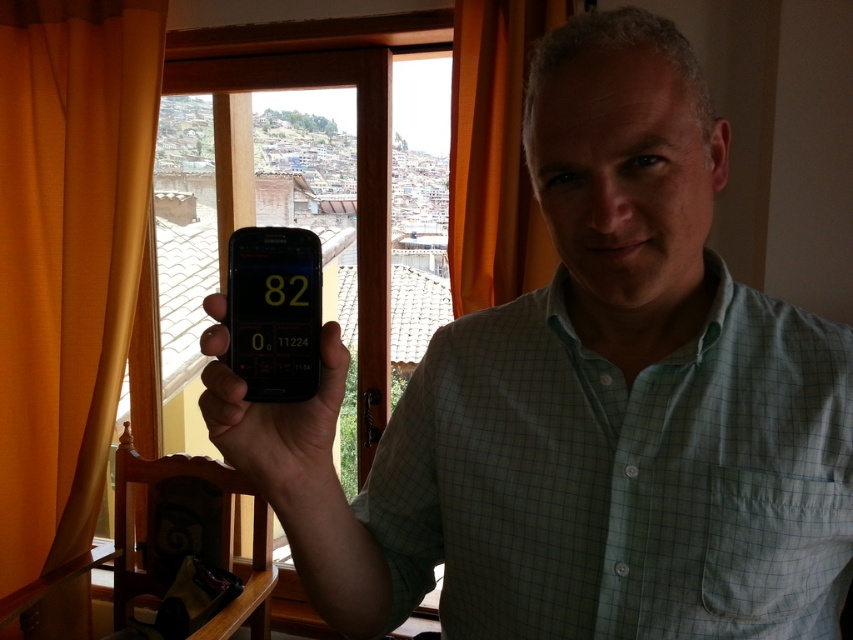
Question: Considering the real-world distances, which object is closest to the green checkered shirt at center?

Choices:
 (A) orange satin curtain at upper right
 (B) black matte phone at center
 (C) orange fabric curtain at left

Answer: (B)

Question: Does orange satin curtain at upper right appear over black matte phone at center?

Choices:
 (A) yes
 (B) no

Answer: (A)

Question: Which object is farther from the camera taking this photo?

Choices:
 (A) black matte phone at center
 (B) orange satin curtain at upper right

Answer: (B)

Question: Which object is closer to the camera taking this photo?

Choices:
 (A) orange satin curtain at upper right
 (B) matte black phone at center
 (C) orange fabric curtain at left
 (D) green checkered shirt at center

Answer: (B)

Question: From the image, what is the correct spatial relationship of orange fabric curtain at left in relation to black matte phone at center?

Choices:
 (A) below
 (B) above

Answer: (B)

Question: Is orange fabric curtain at left positioned before black matte phone at center?

Choices:
 (A) yes
 (B) no

Answer: (B)